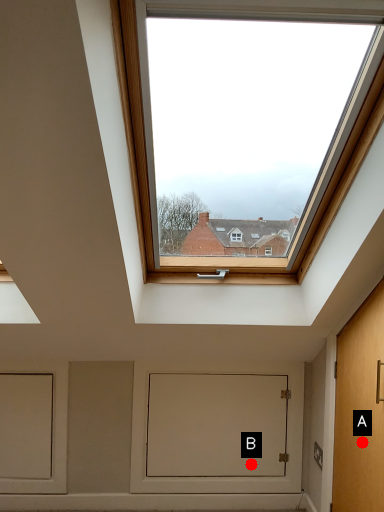
Question: Two points are circled on the image, labeled by A and B beside each circle. Which of the following is the closest to the observer?

Choices:
 (A) A is closer
 (B) B is closer

Answer: (A)